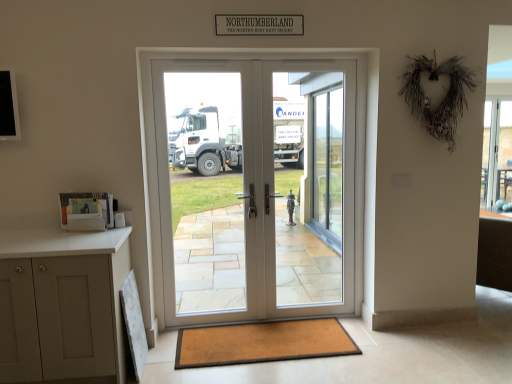
Image resolution: width=512 pixels, height=384 pixels. In order to click on free location above white glossy screen door at center, positioned as the 1th screen door in right-to-left order (from a real-world perspective) in this screenshot , I will do `click(308, 58)`.